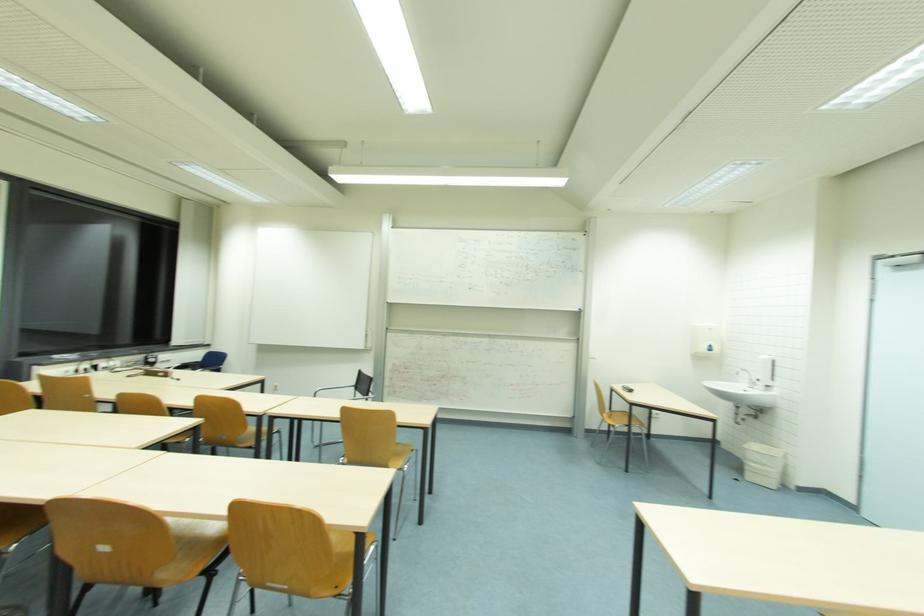
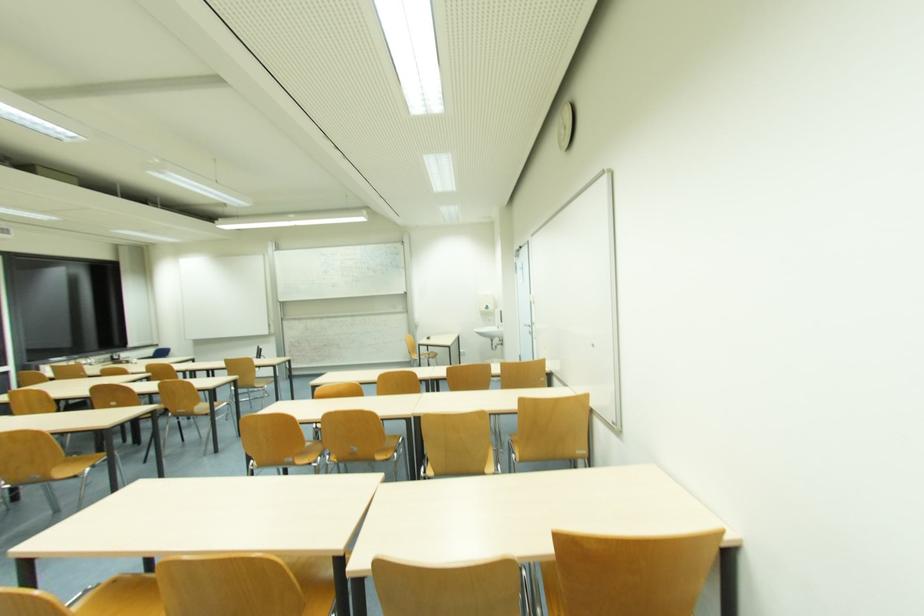
What movement of the cameraman would produce the second image?

The cameraman moved toward right, backward.